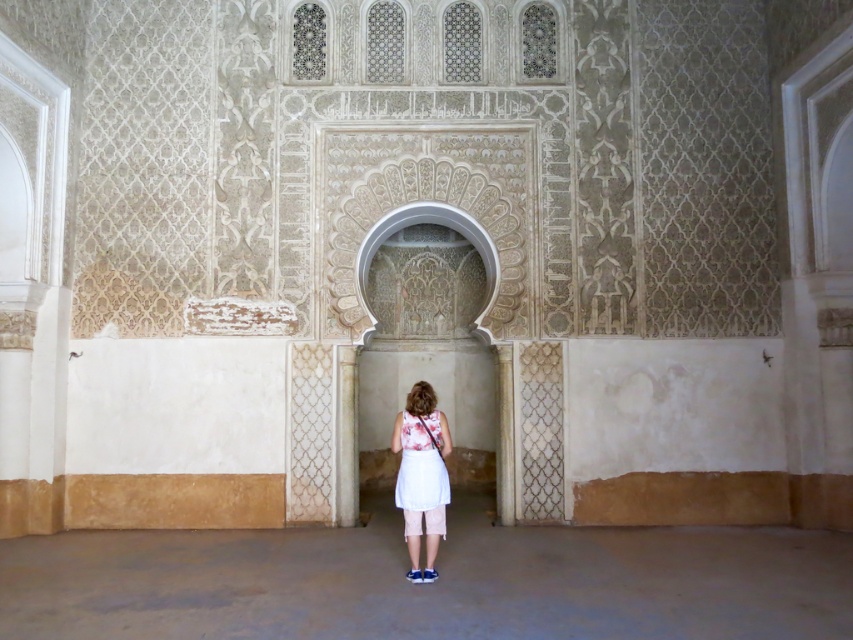
Question: Does white cotton skirt at center have a smaller size compared to white cotton dress at center?

Choices:
 (A) no
 (B) yes

Answer: (A)

Question: Among these objects, which one is farthest from the camera?

Choices:
 (A) white cotton dress at center
 (B) white textured pillar at lower center
 (C) carved stone archway at center
 (D) white cotton skirt at center

Answer: (C)

Question: Is carved stone archway at center thinner than white cotton dress at center?

Choices:
 (A) yes
 (B) no

Answer: (B)

Question: Which object is farther from the camera taking this photo?

Choices:
 (A) white cotton skirt at center
 (B) white cotton dress at center

Answer: (B)

Question: Estimate the real-world distances between objects in this image. Which object is closer to the carved stone archway at center?

Choices:
 (A) white cotton skirt at center
 (B) white textured pillar at lower center

Answer: (B)

Question: Can you confirm if white cotton skirt at center is thinner than carved stone archway at center?

Choices:
 (A) yes
 (B) no

Answer: (A)